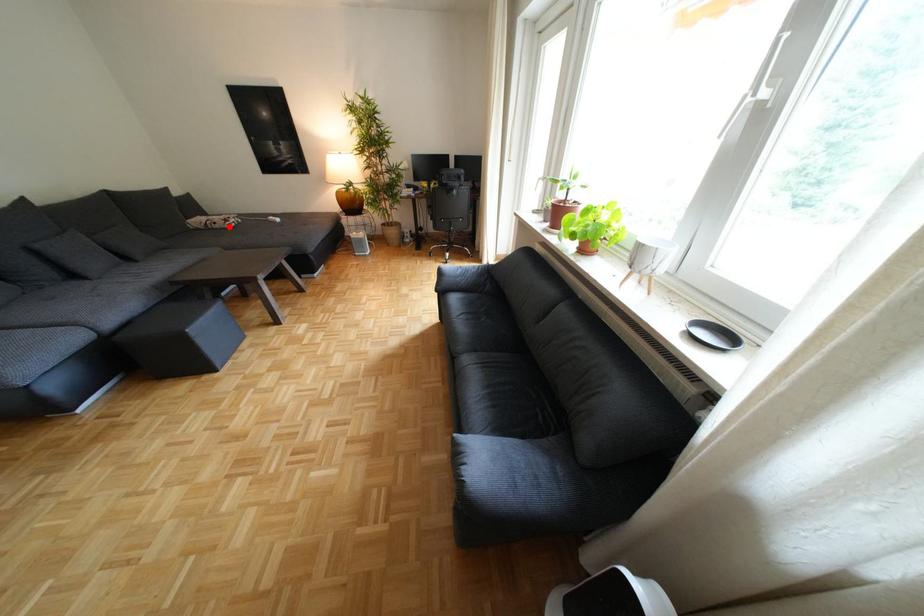
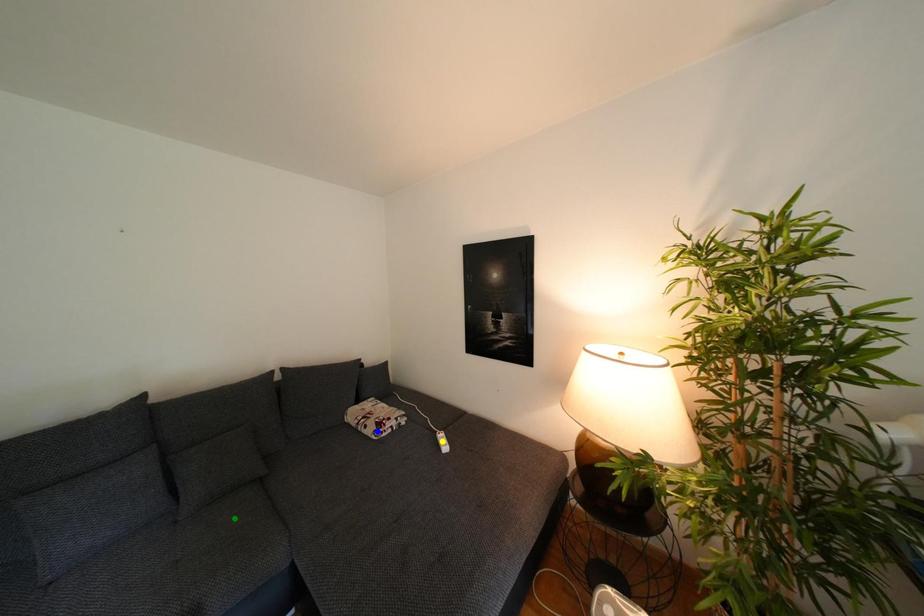
Question: I am providing you with two images of the same scene from different viewpoints. A red point is marked on the first image. You are given multiple points on the second image. In image 2, which mark is for the same physical point as the one in image 1?

Choices:
 (A) green point
 (B) blue point
 (C) yellow point

Answer: (B)